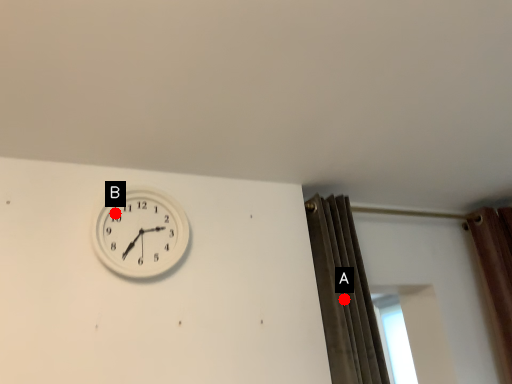
Question: Two points are circled on the image, labeled by A and B beside each circle. Which point is closer to the camera?

Choices:
 (A) A is closer
 (B) B is closer

Answer: (B)